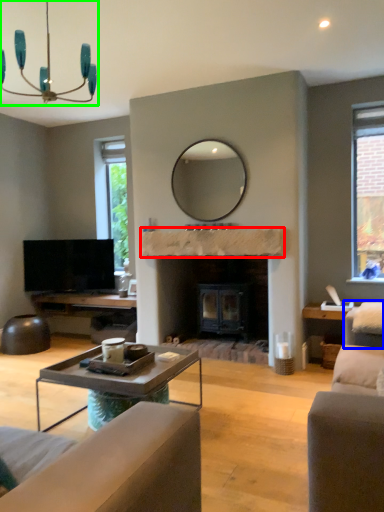
Question: Which object is the closest to the mantle (highlighted by a red box)? Choose among these: swivel chair (highlighted by a blue box) or light fixture (highlighted by a green box).

Choices:
 (A) swivel chair
 (B) light fixture

Answer: (A)